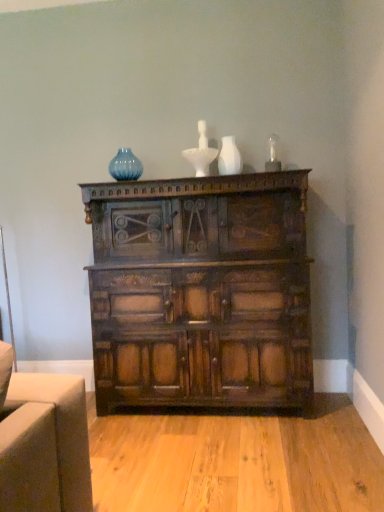
Locate an element on the screen. vacant space in front of dark brown wood chest of drawers at center is located at coordinates (218, 458).